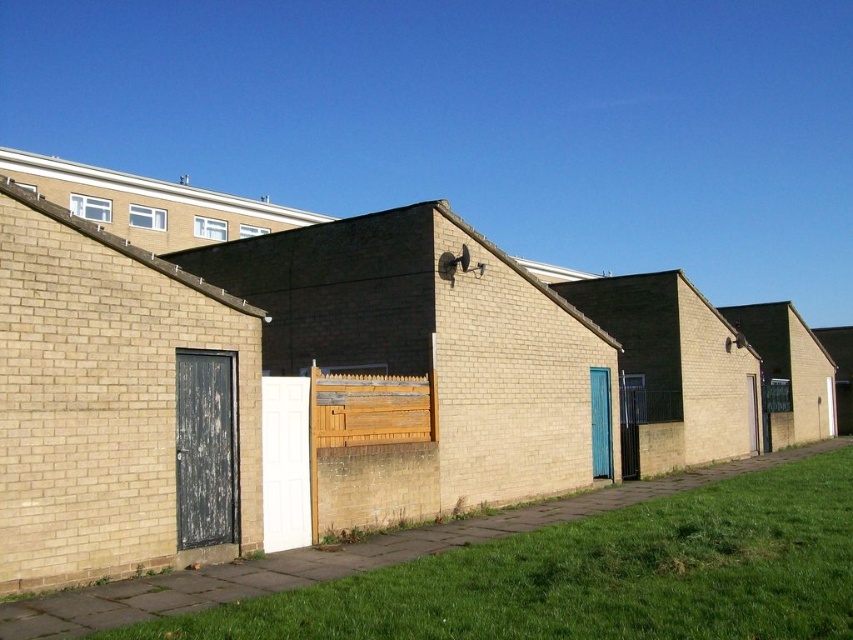
Is green grass at lower right closer to camera compared to weathered wood door at left?

Yes, it is in front of weathered wood door at left.

Does green grass at lower right appear on the right side of weathered wood door at left?

Indeed, green grass at lower right is positioned on the right side of weathered wood door at left.

The image size is (853, 640). What do you see at coordinates (596, 576) in the screenshot?
I see `green grass at lower right` at bounding box center [596, 576].

Identify the location of green grass at lower right. (596, 576).

What do you see at coordinates (206, 449) in the screenshot? Image resolution: width=853 pixels, height=640 pixels. I see `weathered wood door at left` at bounding box center [206, 449].

Locate an element on the screen. weathered wood door at left is located at coordinates (206, 449).

Between green grass at lower right and weathered wood fence at center, which one appears on the right side from the viewer's perspective?

Positioned to the right is green grass at lower right.

Is green grass at lower right taller than weathered wood fence at center?

No, green grass at lower right is not taller than weathered wood fence at center.

Between point (706, 612) and point (312, 426), which one is positioned behind?

Point (312, 426)

At what (x,y) coordinates should I click in order to perform the action: click on green grass at lower right. Please return your answer as a coordinate pair (x, y). The width and height of the screenshot is (853, 640). Looking at the image, I should click on (596, 576).